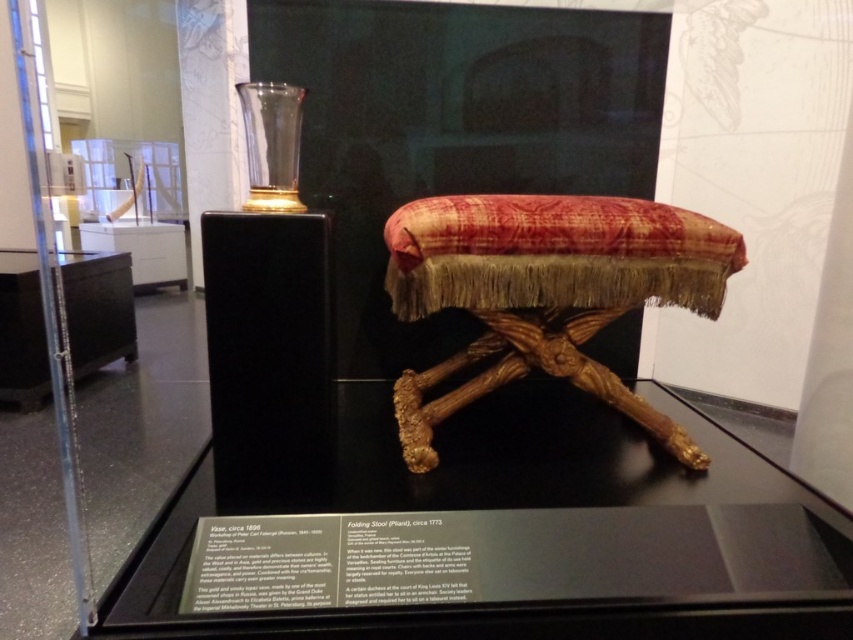
Question: Is transparent glass table at center smaller than velvet-textured stool at center?

Choices:
 (A) yes
 (B) no

Answer: (B)

Question: Does transparent glass table at center have a greater width compared to velvet-textured stool at center?

Choices:
 (A) yes
 (B) no

Answer: (A)

Question: Where is transparent glass table at center located in relation to velvet-textured stool at center in the image?

Choices:
 (A) above
 (B) below

Answer: (B)